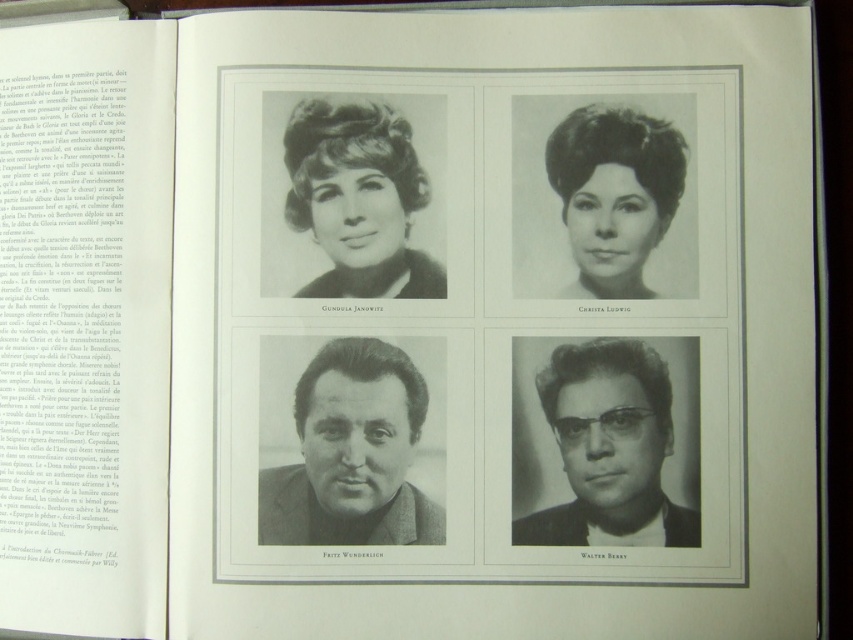
You are designing a layout for a magazine spread and need to ensure that the matte black glasses at bottom right and the matte black hair at upper left are visually balanced. Given their sizes, which object should you adjust to achieve balance?

The matte black glasses at bottom right has a greater height compared to the matte black hair at upper left, so you should reduce the size of the matte black glasses at bottom right to match the smaller size of the matte black hair at upper left for better visual balance.

You are designing a layout for a magazine spread and need to know the spatial relationship between the matte black glasses at bottom right and the matte black hair at upper left. Which object is closer to the viewer in the image?

The matte black glasses at bottom right is in front of matte black hair at upper left, so it is closer to the viewer.

You are designing a layout for a magazine spread and need to place a new element at coordinates that are 0.5 units away from the matte black jacket at center. What are the coordinates where you should place the new element?

The coordinates for the new element should be either 0.709 plus or minus 0.5 in the x direction or 0.414 plus or minus 0.5 in the y direction, resulting in possible coordinates like (352, 639) or (352, 132) or (779, 452) or (352, 452) minus 0.5 which would be negative but since coordinates can be negative, those are valid. However, if the coordinate system is constrained to 0 to 1, then subtracting 0.5 would give (352, 132) or (779, 452) or (352, 452) minus 0.5 would be negative which is invalid. 0